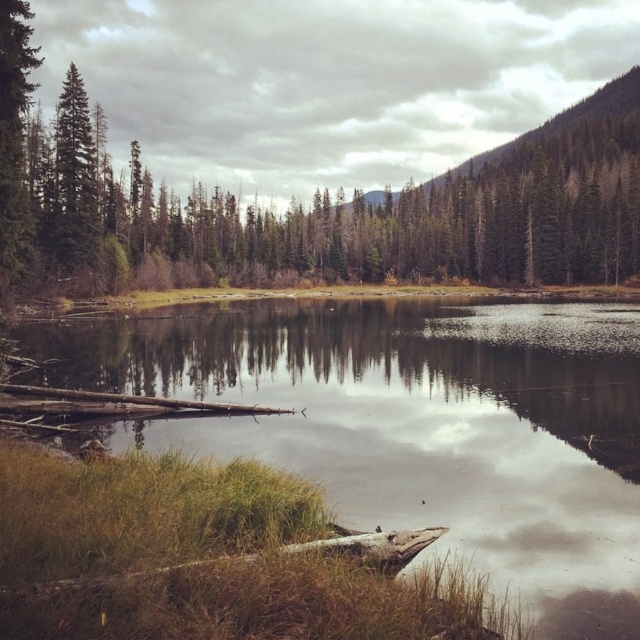
Question: Can you confirm if smooth reflective water at center is positioned above green matte tree at center?

Choices:
 (A) yes
 (B) no

Answer: (B)

Question: Is smooth reflective water at center bigger than green matte tree at center?

Choices:
 (A) yes
 (B) no

Answer: (B)

Question: Among these points, which one is farthest from the camera?

Choices:
 (A) (36, 161)
 (B) (176, 356)

Answer: (A)

Question: Can you confirm if smooth reflective water at center is thinner than green matte tree at center?

Choices:
 (A) no
 (B) yes

Answer: (B)